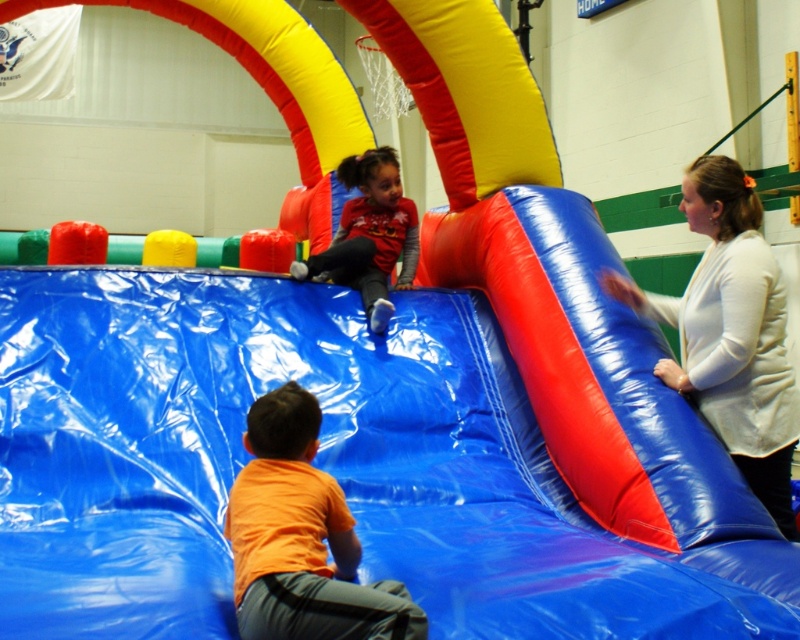
Can you confirm if white matte jacket at right is wider than matte red shirt at upper center?

In fact, white matte jacket at right might be narrower than matte red shirt at upper center.

Is white matte jacket at right shorter than matte red shirt at upper center?

No.

Which is in front, point (784, 442) or point (380, 308)?

Point (784, 442) is more forward.

The image size is (800, 640). I want to click on white matte jacket at right, so click(732, 332).

Is white matte jacket at right above orange matte shirt at lower center?

Correct, white matte jacket at right is located above orange matte shirt at lower center.

Does point (608, 282) come behind point (286, 612)?

Yes, point (608, 282) is farther from viewer.

The width and height of the screenshot is (800, 640). I want to click on white matte jacket at right, so click(732, 332).

Does orange matte shirt at lower center lie in front of matte red shirt at upper center?

Yes, orange matte shirt at lower center is closer to the viewer.

The height and width of the screenshot is (640, 800). I want to click on orange matte shirt at lower center, so click(302, 538).

Based on the photo, who is more distant from viewer, (276, 486) or (348, 276)?

Point (348, 276)

Where is `orange matte shirt at lower center`? Image resolution: width=800 pixels, height=640 pixels. orange matte shirt at lower center is located at coordinates (302, 538).